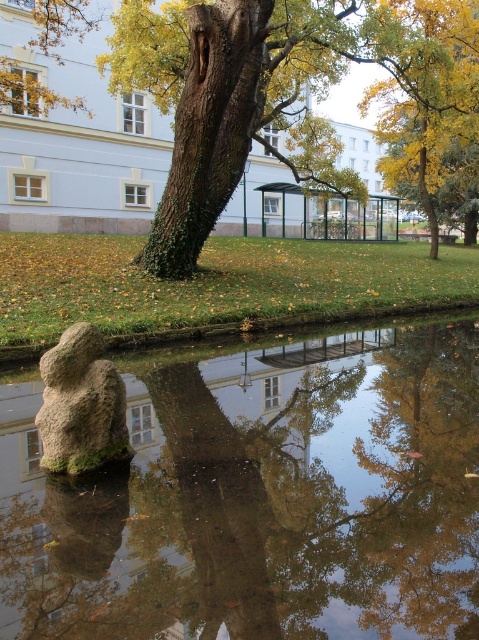
Measure the distance between point (x=133, y=394) and camera.

Point (x=133, y=394) and camera are 22.15 feet apart.

Does transparent glass water at center have a smaller size compared to green rough bark tree at center?

Yes.

The height and width of the screenshot is (640, 479). What do you see at coordinates (260, 497) in the screenshot? I see `transparent glass water at center` at bounding box center [260, 497].

You are a GUI agent. You are given a task and a screenshot of the screen. Output one action in this format:
    pyautogui.click(x=<x>, y=<y>)
    Task: Click on the transparent glass water at center
    The height and width of the screenshot is (640, 479).
    Given the screenshot: What is the action you would take?
    pyautogui.click(x=260, y=497)

Can you confirm if transparent glass water at center is positioned above yellow-green leaves at upper center?

No, transparent glass water at center is not above yellow-green leaves at upper center.

Between point (264, 444) and point (420, 61), which one is positioned behind?

Positioned behind is point (420, 61).

Between point (410, 483) and point (412, 144), which one is positioned behind?

Point (412, 144)

This screenshot has width=479, height=640. What are the coordinates of `transparent glass water at center` in the screenshot? It's located at (260, 497).

I want to click on green rough bark tree at center, so click(246, 97).

At what (x,y) coordinates should I click in order to perform the action: click on green rough bark tree at center. Please return your answer as a coordinate pair (x, y). This screenshot has height=640, width=479. Looking at the image, I should click on (246, 97).